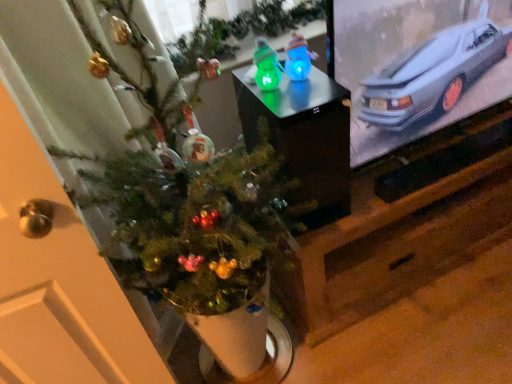
Question: Is blue translucent snowman at center, placed as the 1th toy when sorted from right to left, facing towards green translucent toy at center, which is the 1th toy in left-to-right order?

Choices:
 (A) no
 (B) yes

Answer: (A)

Question: Does blue translucent snowman at center, placed as the second toy when sorted from left to right, have a lesser height compared to green translucent toy at center, marked as the second toy in a right-to-left arrangement?

Choices:
 (A) no
 (B) yes

Answer: (A)

Question: Is blue translucent snowman at center, placed as the 1th toy when sorted from right to left, in front of green translucent toy at center, marked as the second toy in a right-to-left arrangement?

Choices:
 (A) no
 (B) yes

Answer: (A)

Question: From the image's perspective, is blue translucent snowman at center, placed as the second toy when sorted from left to right, over green translucent toy at center, marked as the second toy in a right-to-left arrangement?

Choices:
 (A) yes
 (B) no

Answer: (A)

Question: Would you consider blue translucent snowman at center, placed as the 1th toy when sorted from right to left, to be distant from green translucent toy at center, marked as the second toy in a right-to-left arrangement?

Choices:
 (A) no
 (B) yes

Answer: (A)

Question: From the image's perspective, is blue translucent snowman at center, placed as the second toy when sorted from left to right, below green translucent toy at center, which is the 1th toy in left-to-right order?

Choices:
 (A) no
 (B) yes

Answer: (A)

Question: Considering the relative positions of green translucent toy at center, which is the 1th toy in left-to-right order, and glossy plastic snowmen at center in the image provided, is green translucent toy at center, which is the 1th toy in left-to-right order, to the right of glossy plastic snowmen at center from the viewer's perspective?

Choices:
 (A) yes
 (B) no

Answer: (B)

Question: From the image's perspective, does green translucent toy at center, which is the 1th toy in left-to-right order, appear lower than glossy plastic snowmen at center?

Choices:
 (A) yes
 (B) no

Answer: (B)

Question: Considering the relative sizes of green translucent toy at center, which is the 1th toy in left-to-right order, and glossy plastic snowmen at center in the image provided, is green translucent toy at center, which is the 1th toy in left-to-right order, bigger than glossy plastic snowmen at center?

Choices:
 (A) no
 (B) yes

Answer: (A)

Question: Is green translucent toy at center, which is the 1th toy in left-to-right order, positioned in front of glossy plastic snowmen at center?

Choices:
 (A) no
 (B) yes

Answer: (A)

Question: Would you consider green translucent toy at center, which is the 1th toy in left-to-right order, to be distant from glossy plastic snowmen at center?

Choices:
 (A) yes
 (B) no

Answer: (B)

Question: Is green translucent toy at center, marked as the second toy in a right-to-left arrangement, thinner than glossy plastic snowmen at center?

Choices:
 (A) no
 (B) yes

Answer: (B)

Question: Is blue translucent snowman at center, placed as the second toy when sorted from left to right, in contact with glossy plastic snowmen at center?

Choices:
 (A) yes
 (B) no

Answer: (B)